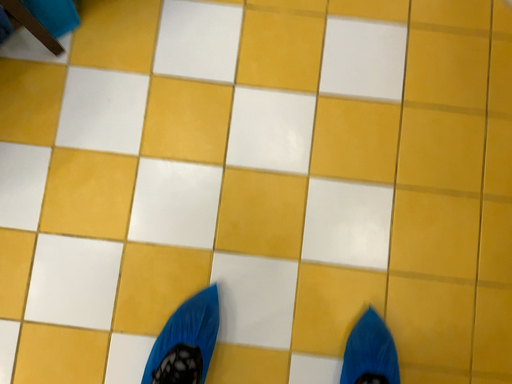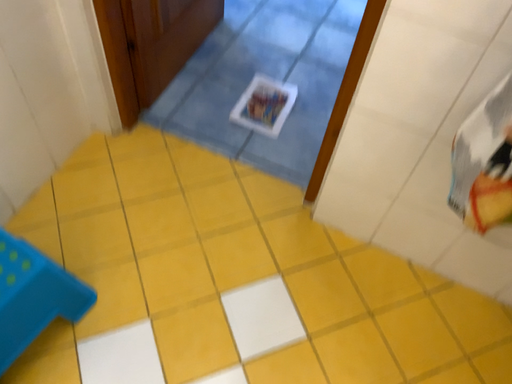
Question: Which way did the camera rotate in the video?

Choices:
 (A) rotated left
 (B) rotated right

Answer: (B)